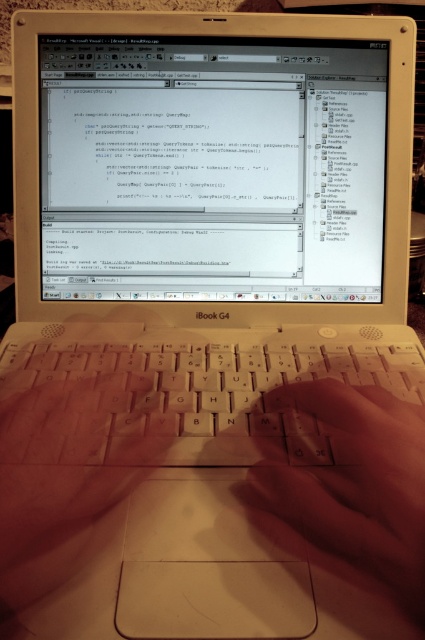
Question: Which object appears farthest from the camera in this image?

Choices:
 (A) smooth skin hand at center
 (B) matte black screen at center

Answer: (B)

Question: Which point appears farthest from the camera in this image?

Choices:
 (A) (371, 275)
 (B) (56, 420)

Answer: (A)

Question: Is white plastic keyboard at center closer to camera compared to smooth skin hand at center?

Choices:
 (A) yes
 (B) no

Answer: (B)

Question: Does matte black screen at center appear on the left side of white plastic keyboard at center?

Choices:
 (A) no
 (B) yes

Answer: (B)

Question: Does white plastic keyboard at center appear on the left side of smooth skin hand at center?

Choices:
 (A) yes
 (B) no

Answer: (A)

Question: Which point is closer to the camera taking this photo?

Choices:
 (A) (329, 410)
 (B) (17, 353)

Answer: (A)